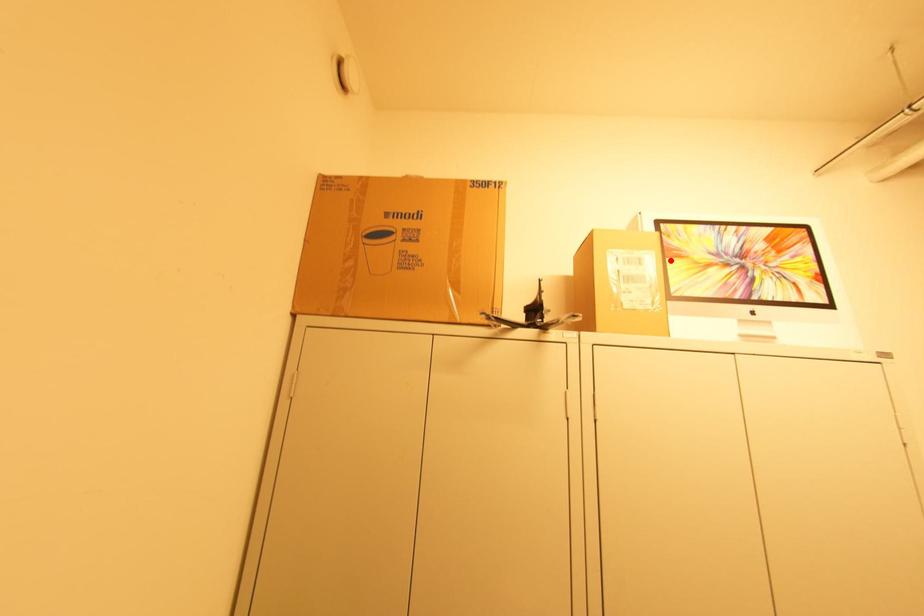
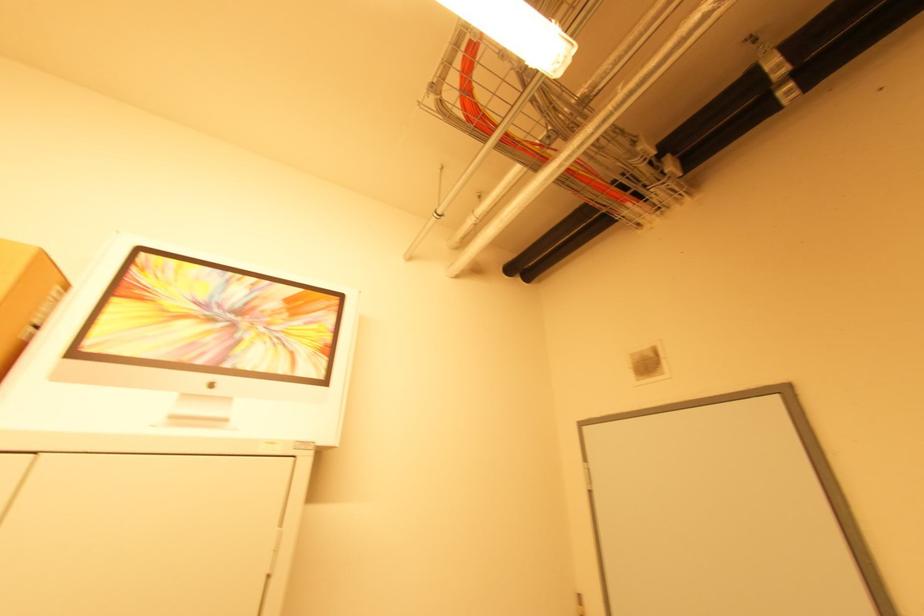
Question: I am providing you with two images of the same scene from different viewpoints. A red point is marked on the first image. Is the red point's position out of view in image 2?

Choices:
 (A) Yes
 (B) No

Answer: (B)